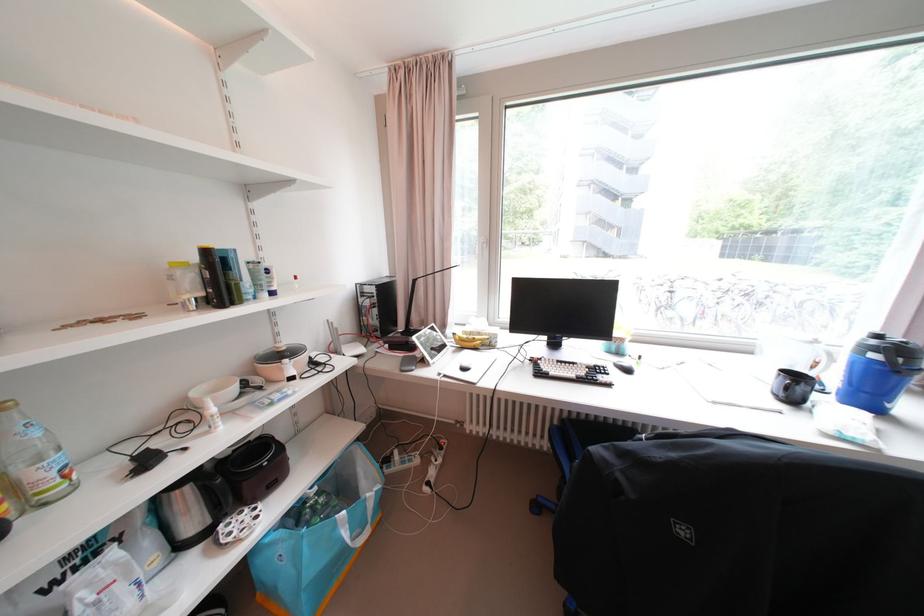
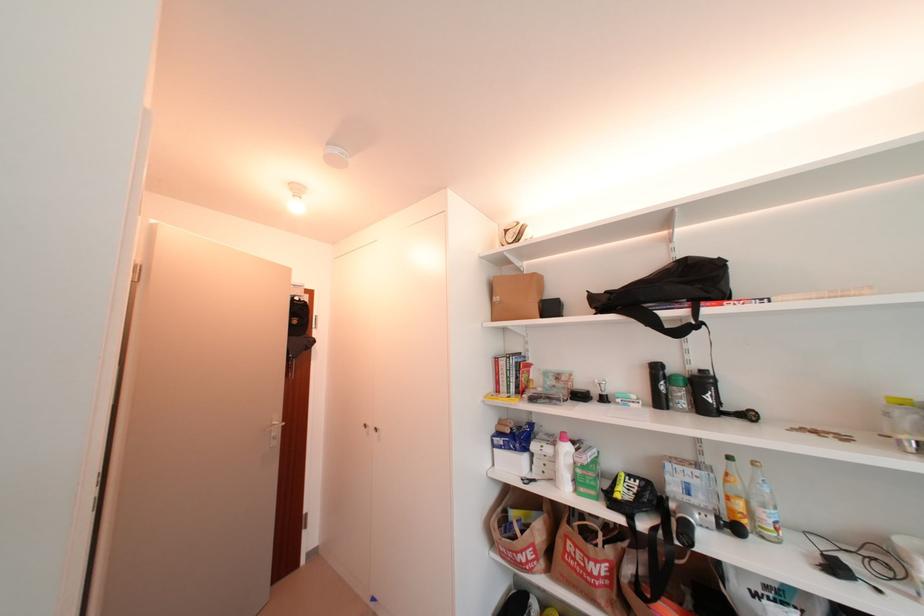
Question: The images are taken continuously from a first-person perspective. In which direction is your viewpoint rotating?

Choices:
 (A) Left
 (B) Right
 (C) Up
 (D) Down

Answer: (A)